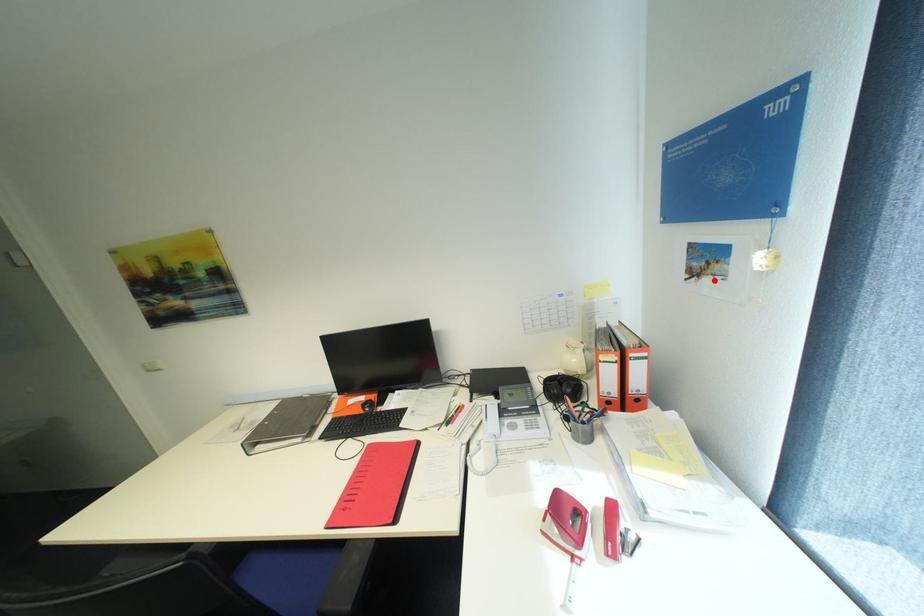
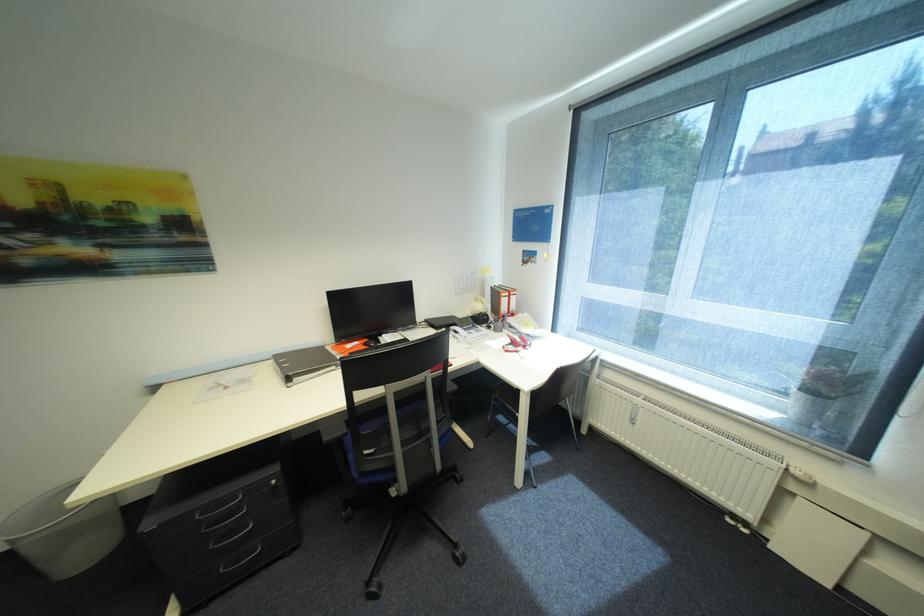
In the second image, find the point that corresponds to the highlighted location in the first image.

(537, 265)